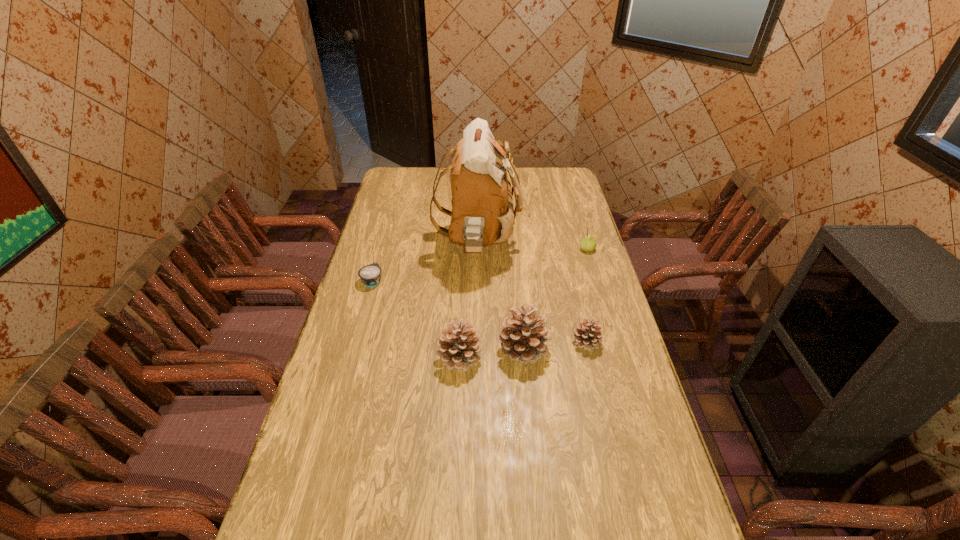
I want to click on free location at the left edge, so click(x=302, y=488).

Identify the location of blank area at the right edge. The width and height of the screenshot is (960, 540). (560, 242).

The height and width of the screenshot is (540, 960). Find the location of `free space at the far left corner`. free space at the far left corner is located at coordinates (395, 176).

Image resolution: width=960 pixels, height=540 pixels. In the image, there is a desktop. In order to click on vacant region at the near left corner in this screenshot , I will do pos(327,534).

The width and height of the screenshot is (960, 540). In the image, there is a desktop. In order to click on free space at the far right corner in this screenshot , I will do `click(548, 186)`.

Find the location of a particular element. This screenshot has height=540, width=960. vacant space that is in between the leftmost object and the tallest object is located at coordinates (425, 262).

Locate an element on the screen. The width and height of the screenshot is (960, 540). vacant space that's between the leftmost object and the second pinecone from right to left is located at coordinates (448, 315).

The image size is (960, 540). What are the coordinates of `free point between the backpack and the second pinecone from right to left` in the screenshot? It's located at (501, 296).

Where is `free area in between the leftmost object and the rightmost pinecone`? This screenshot has height=540, width=960. free area in between the leftmost object and the rightmost pinecone is located at coordinates (479, 312).

The height and width of the screenshot is (540, 960). I want to click on vacant area between the tallest object and the shortest pinecone, so click(x=532, y=293).